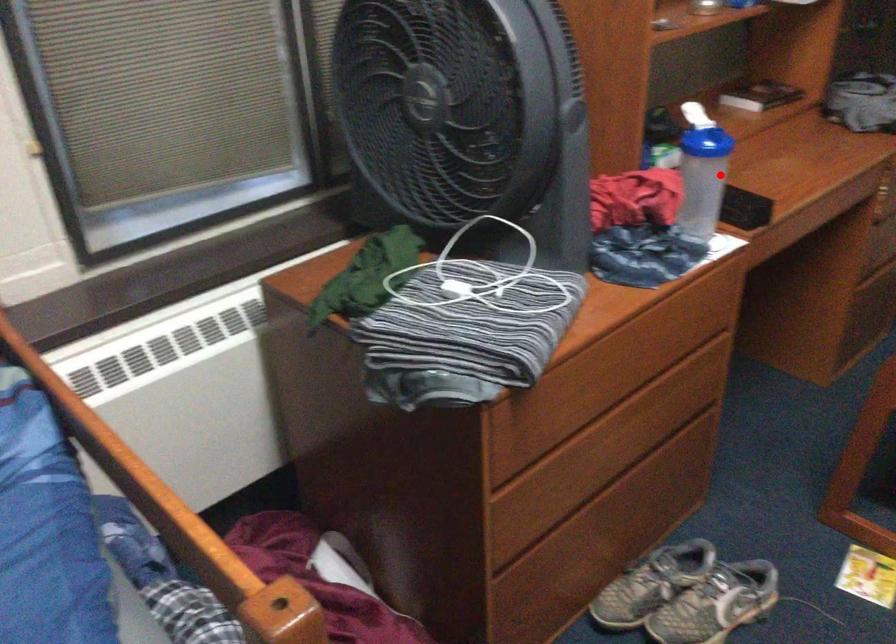
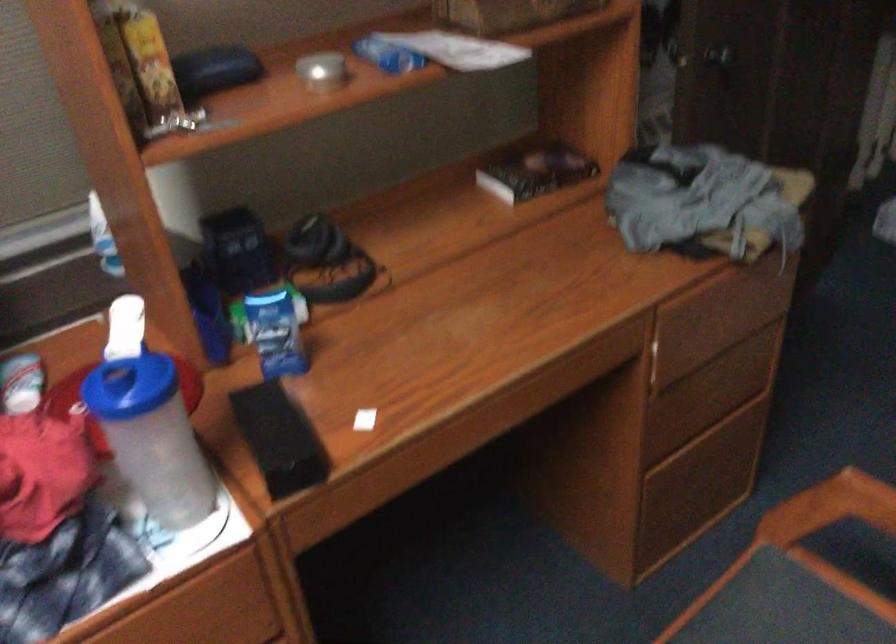
Question: A red point is marked in image1. In image2, is the corresponding 3D point closer to the camera or farther? Reply with the corresponding letter.

Choices:
 (A) The corresponding 3D point is closer.
 (B) The corresponding 3D point is farther.

Answer: (A)